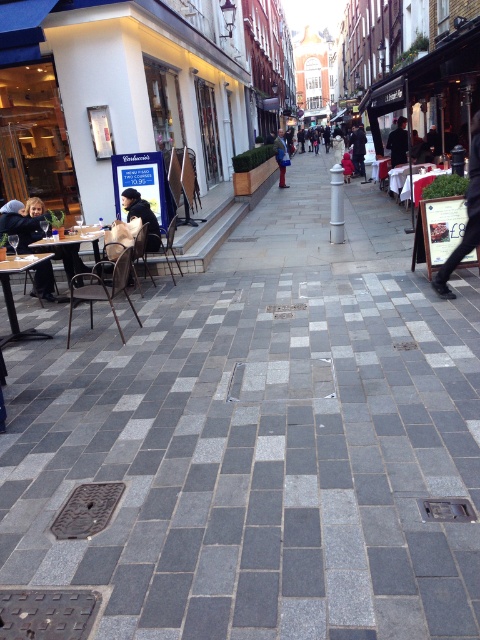
Question: Which point is farther to the camera?

Choices:
 (A) denim jacket at center
 (B) wooden table at lower left

Answer: (A)

Question: Which is farther from the white glossy table at center?

Choices:
 (A) metallic brown chair at left
 (B) matte black jacket at left

Answer: (A)

Question: Where is metallic silver chair at center-left located in relation to black fabric jacket at right in the image?

Choices:
 (A) below
 (B) above

Answer: (A)

Question: Considering the real-world distances, which object is farthest from the wooden table at left?

Choices:
 (A) matte black jacket at left
 (B) dark blue jeans at center
 (C) dark brown leather jacket at center
 (D) denim jacket at center

Answer: (D)

Question: Can you confirm if metallic brown chair at left is positioned to the left of metallic silver chair at center-left?

Choices:
 (A) yes
 (B) no

Answer: (A)

Question: Is wooden table at lower left above dark blue coat at center?

Choices:
 (A) no
 (B) yes

Answer: (A)